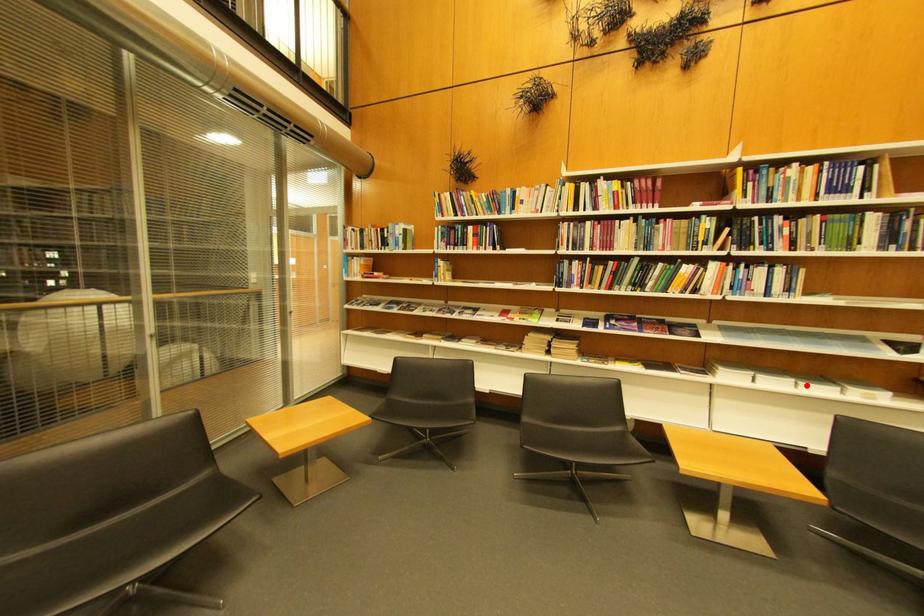
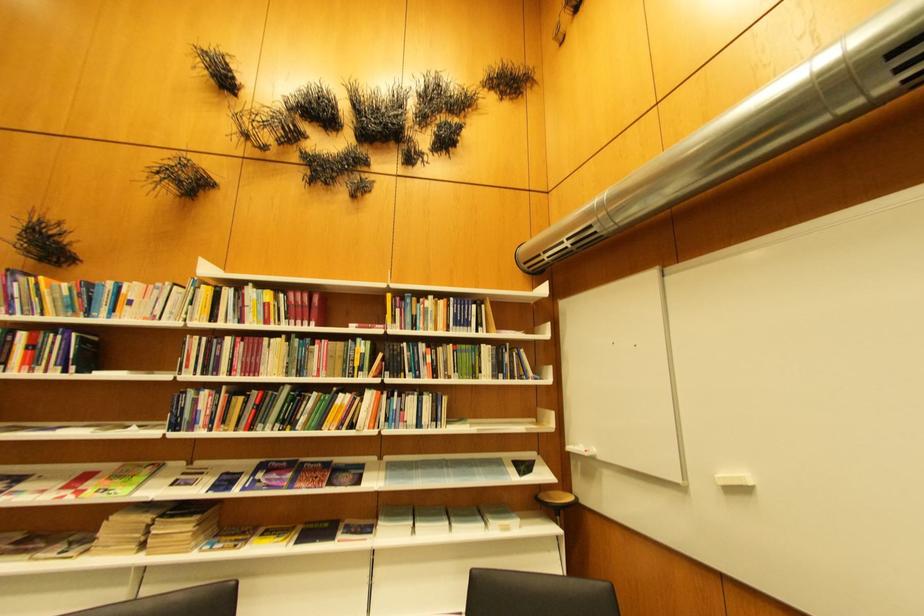
Locate, in the second image, the point that corresponds to the highlighted location in the first image.

(460, 527)